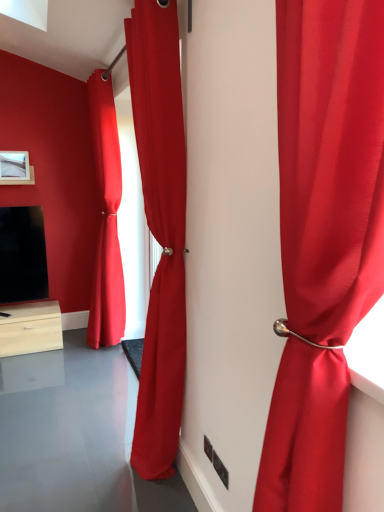
Question: From a real-world perspective, is satin red curtain at center, the 2th curtain viewed from the back, under matte white picture frame at upper left?

Choices:
 (A) yes
 (B) no

Answer: (A)

Question: Can you confirm if satin red curtain at center, which ranks as the 2th curtain in right-to-left order, is shorter than matte white picture frame at upper left?

Choices:
 (A) no
 (B) yes

Answer: (A)

Question: Is satin red curtain at center, arranged as the 2th curtain when viewed from the left, in front of matte white picture frame at upper left?

Choices:
 (A) yes
 (B) no

Answer: (A)

Question: Are satin red curtain at center, arranged as the 2th curtain when viewed from the left, and matte white picture frame at upper left far apart?

Choices:
 (A) yes
 (B) no

Answer: (A)

Question: From the image's perspective, is satin red curtain at center, the 2th curtain viewed from the back, on matte white picture frame at upper left?

Choices:
 (A) no
 (B) yes

Answer: (A)

Question: Is satin red curtain at center, which ranks as the 2th curtain in right-to-left order, to the right of matte white picture frame at upper left from the viewer's perspective?

Choices:
 (A) no
 (B) yes

Answer: (B)

Question: Considering the relative sizes of satin red curtain at center, which is counted as the first curtain, starting from the left, and satin red curtain at right, placed as the first curtain when sorted from right to left, in the image provided, is satin red curtain at center, which is counted as the first curtain, starting from the left, bigger than satin red curtain at right, placed as the first curtain when sorted from right to left,?

Choices:
 (A) no
 (B) yes

Answer: (B)

Question: Is satin red curtain at center, which is counted as the first curtain, starting from the left, taller than satin red curtain at right, which is counted as the 3th curtain, starting from the back?

Choices:
 (A) yes
 (B) no

Answer: (A)

Question: Could you tell me if satin red curtain at center, which is counted as the first curtain, starting from the left, is turned towards satin red curtain at right, the third curtain positioned from the left?

Choices:
 (A) yes
 (B) no

Answer: (B)

Question: Would you say satin red curtain at center, which is counted as the third curtain, starting from the front, contains satin red curtain at right, placed as the first curtain when sorted from right to left?

Choices:
 (A) no
 (B) yes

Answer: (A)

Question: Can you confirm if satin red curtain at center, which is the first curtain from back to front, is thinner than satin red curtain at right, placed as the first curtain when sorted from right to left?

Choices:
 (A) no
 (B) yes

Answer: (A)

Question: From a real-world perspective, is satin red curtain at center, which is counted as the third curtain, starting from the front, under satin red curtain at right, which is the 1th curtain in front-to-back order?

Choices:
 (A) yes
 (B) no

Answer: (A)

Question: From the image's perspective, is satin red curtain at center, the 2th curtain viewed from the back, on satin red curtain at center, which appears as the 3th curtain when viewed from the right?

Choices:
 (A) yes
 (B) no

Answer: (B)